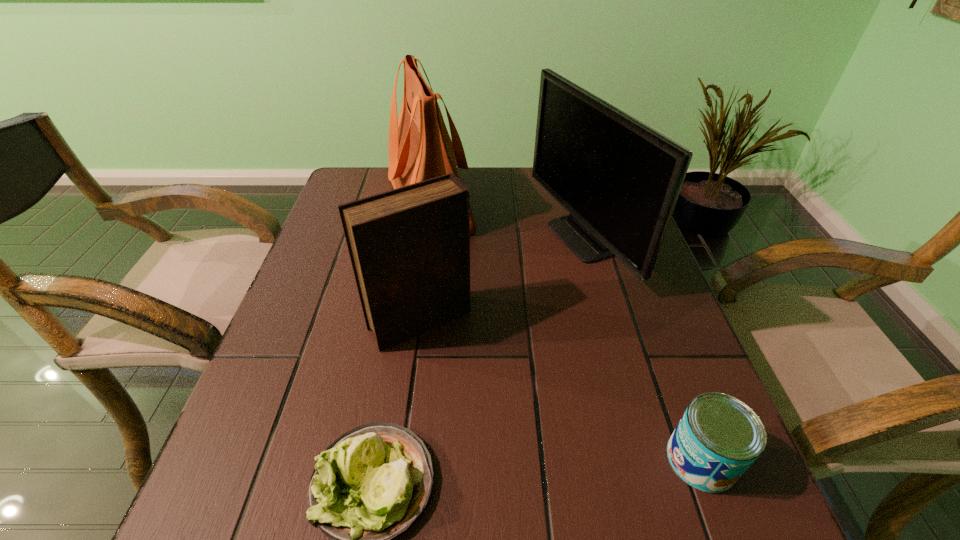
The height and width of the screenshot is (540, 960). I want to click on object that stands as the third closest to the computer monitor, so click(x=718, y=438).

At what (x,y) coordinates should I click in order to perform the action: click on the fourth closest object to the shortest object. Please return your answer as a coordinate pair (x, y). Looking at the image, I should click on (420, 148).

Identify the location of free space that satisfies the following two spatial constraints: 1. on the front-facing side of the fourth tallest object; 2. on the left side of the computer monitor. (638, 460).

This screenshot has height=540, width=960. Find the location of `free point that satisfies the following two spatial constraints: 1. on the front-facing side of the computer monitor; 2. on the right side of the can`. free point that satisfies the following two spatial constraints: 1. on the front-facing side of the computer monitor; 2. on the right side of the can is located at coordinates (638, 460).

This screenshot has height=540, width=960. I want to click on free space that satisfies the following two spatial constraints: 1. on the front-facing side of the computer monitor; 2. on the front side of the Bible, so click(x=601, y=321).